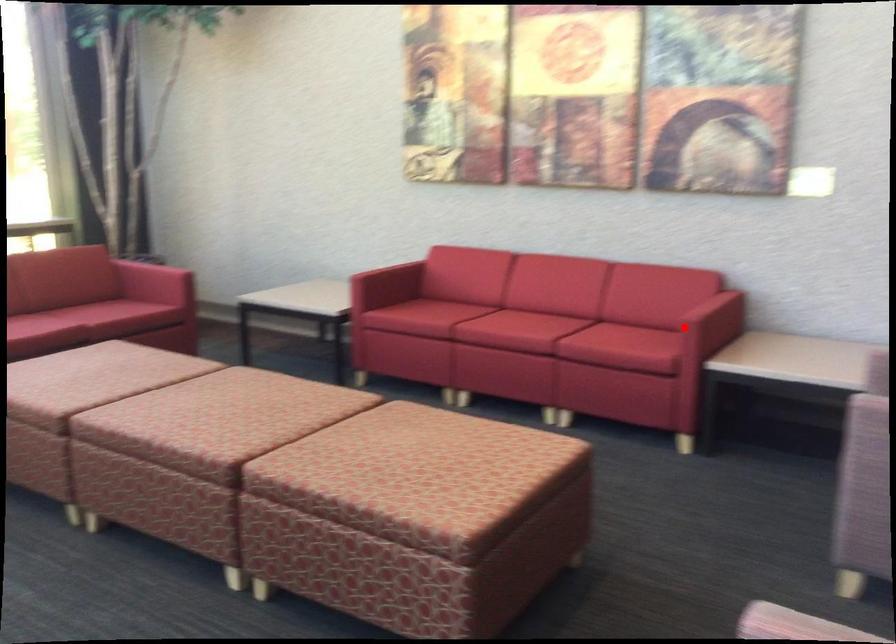
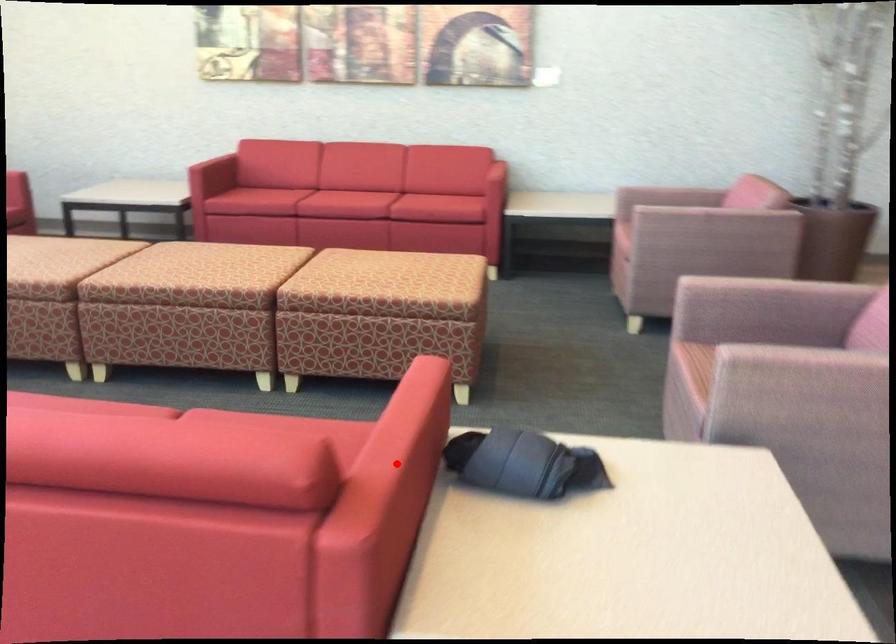
I am providing you with two images of the same scene from different viewpoints. A red point is marked on the first image and another point is marked on the second image. Is the marked point in image1 the same physical position as the marked point in image2?

No